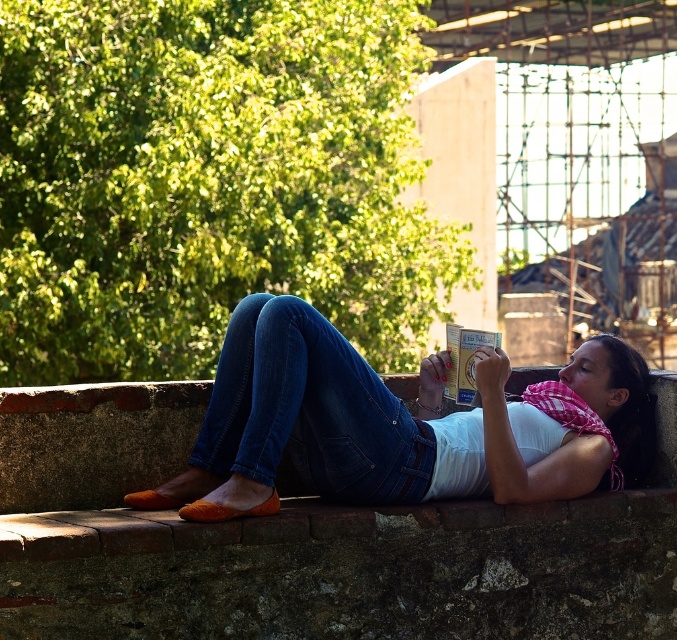
You are a photographer trying to capture a candid shot of the person reading. Since you want to focus on their clothing, which part of their outfit should you adjust your camera focus to prioritize between the white cotton shirt at center and the denim at center?

The white cotton shirt at center is closer to the viewer than the denim at center, so focusing on the white cotton shirt at center will ensure it is in sharp focus while the denim at center may appear slightly blurred.

You are a fashion designer observing this scene. You need to determine which clothing item is shorter between the white cotton shirt at center and the denim at center. Which one is it?

The white cotton shirt at center is shorter than the denim at center.